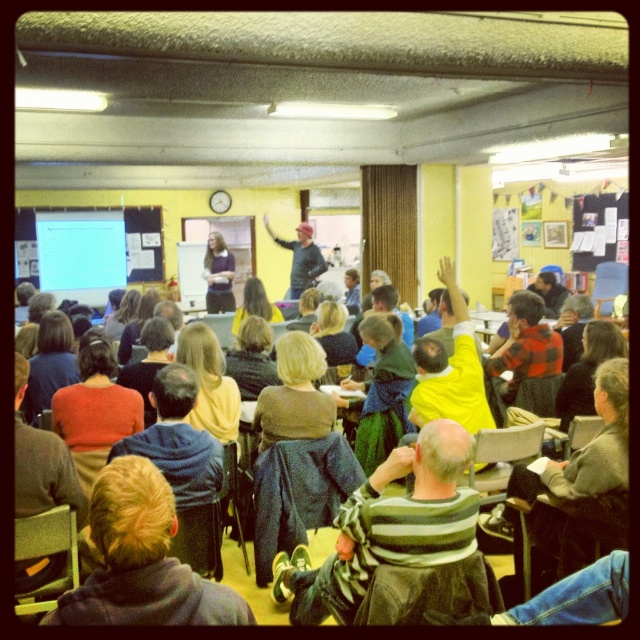
Question: Is striped sweater at center closer to the viewer compared to dark blue sweater at center?

Choices:
 (A) yes
 (B) no

Answer: (A)

Question: Is striped sweater at center positioned in front of dark blue sweater at center?

Choices:
 (A) yes
 (B) no

Answer: (A)

Question: Which point is closer to the camera?

Choices:
 (A) dark blue sweater at center
 (B) matte black shirt at center
 (C) striped sweater at center

Answer: (C)

Question: Does striped sweater at center have a smaller size compared to dark blue sweater at center?

Choices:
 (A) no
 (B) yes

Answer: (A)

Question: Which point is farther to the camera?

Choices:
 (A) (218, 310)
 (B) (305, 234)

Answer: (A)

Question: Which object is farther from the camera taking this photo?

Choices:
 (A) dark blue sweater at center
 (B) striped sweater at center

Answer: (A)